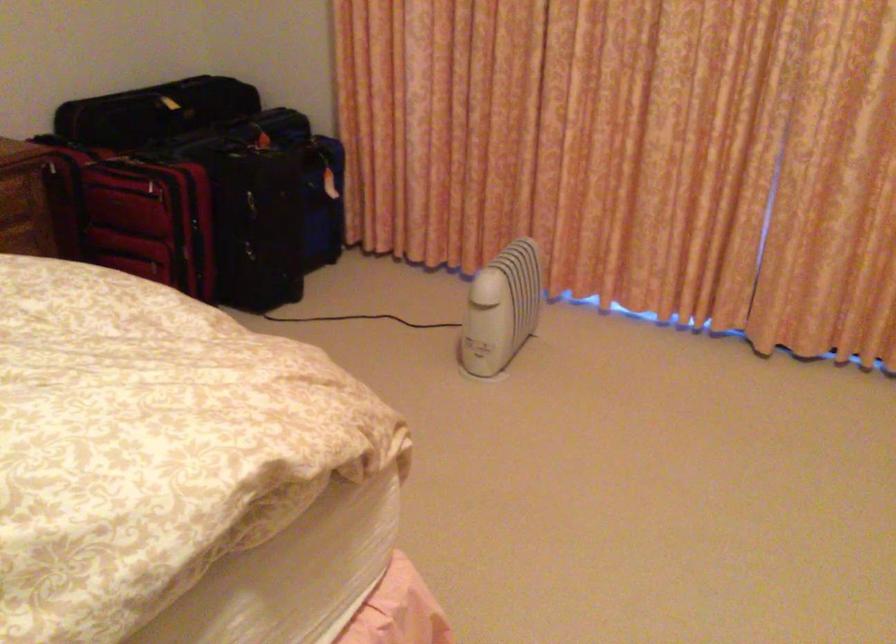
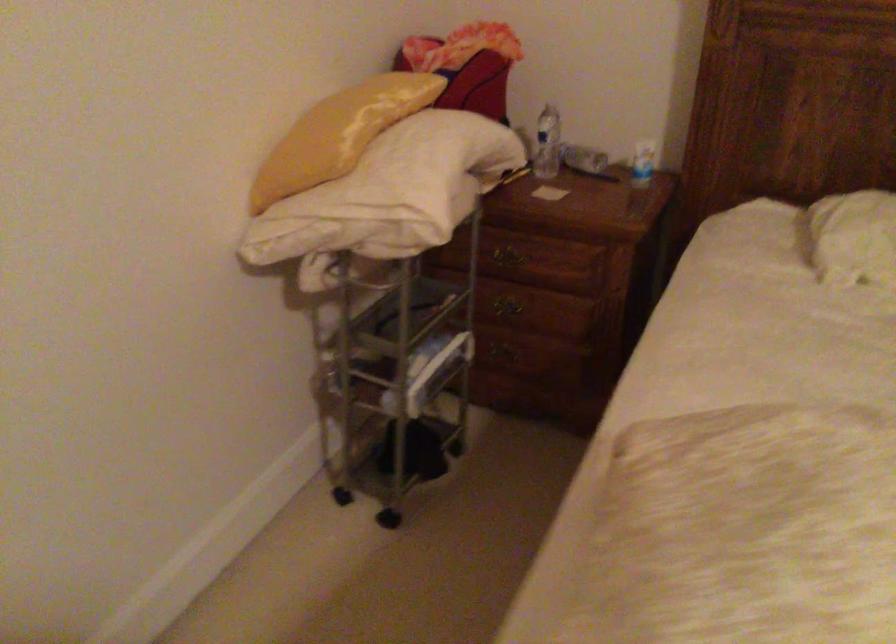
Based on the continuous images, in which direction is the camera rotating?

The camera rotated toward left-down.